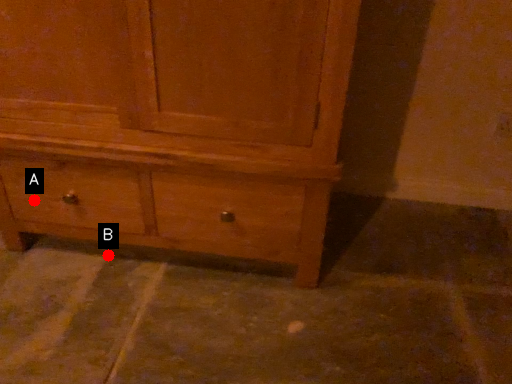
Question: Two points are circled on the image, labeled by A and B beside each circle. Which of the following is the farthest from the observer?

Choices:
 (A) A is further
 (B) B is further

Answer: (B)